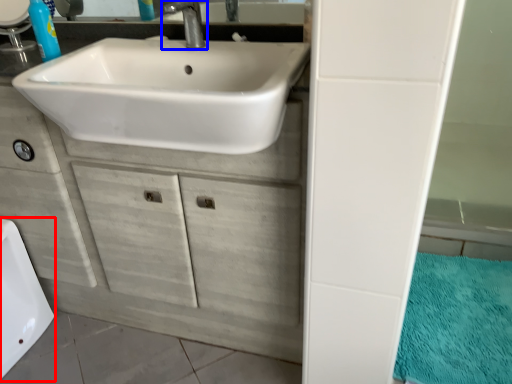
Question: Which of the following is the closest to the observer, bath (highlighted by a red box) or tap (highlighted by a blue box)?

Choices:
 (A) bath
 (B) tap

Answer: (B)